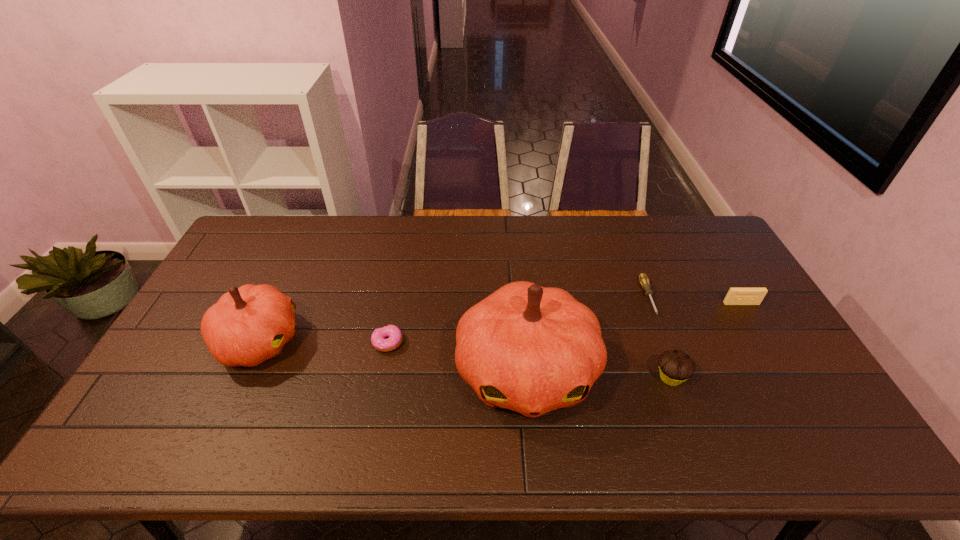
You are a GUI agent. You are given a task and a screenshot of the screen. Output one action in this format:
    pyautogui.click(x=<x>, y=<y>)
    Task: Click on the left pumpkin
    This screenshot has height=540, width=960.
    Given the screenshot: What is the action you would take?
    (x=248, y=325)

At what (x,y) coordinates should I click in order to perform the action: click on the leftmost object. Please return your answer as a coordinate pair (x, y). Image resolution: width=960 pixels, height=540 pixels. Looking at the image, I should click on (248, 325).

Identify the location of the third object from left to right. This screenshot has height=540, width=960. tap(531, 349).

Where is `the taller pumpkin`? the taller pumpkin is located at coordinates (531, 349).

I want to click on screwdriver, so click(x=643, y=279).

What are the coordinates of `the fifth tallest object` in the screenshot? It's located at (378, 341).

Locate an element on the screen. Image resolution: width=960 pixels, height=540 pixels. doughnut is located at coordinates (378, 341).

Identify the location of the rightmost object. The height and width of the screenshot is (540, 960). coord(736,296).

You are a GUI agent. You are given a task and a screenshot of the screen. Output one action in this format:
    pyautogui.click(x=<x>, y=<y>)
    Task: Click on the videotape
    This screenshot has width=960, height=540.
    Given the screenshot: What is the action you would take?
    pyautogui.click(x=736, y=296)

The width and height of the screenshot is (960, 540). What are the coordinates of `the fourth shortest object` in the screenshot? It's located at (676, 366).